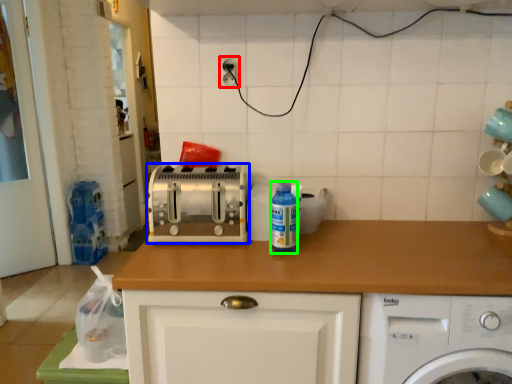
Question: Considering the real-world distances, which object is closest to electric outlet (highlighted by a red box)? toaster (highlighted by a blue box) or bottle (highlighted by a green box).

Choices:
 (A) toaster
 (B) bottle

Answer: (A)